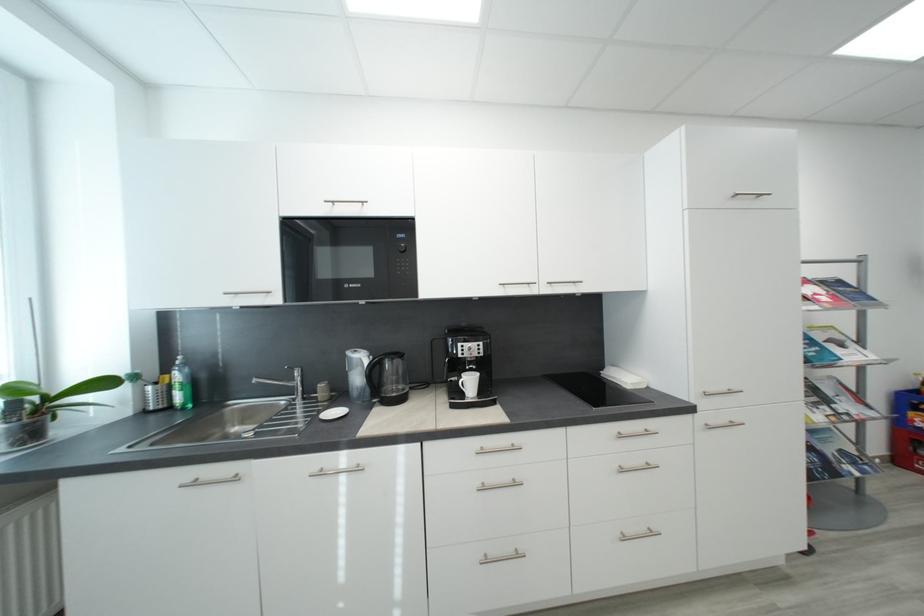
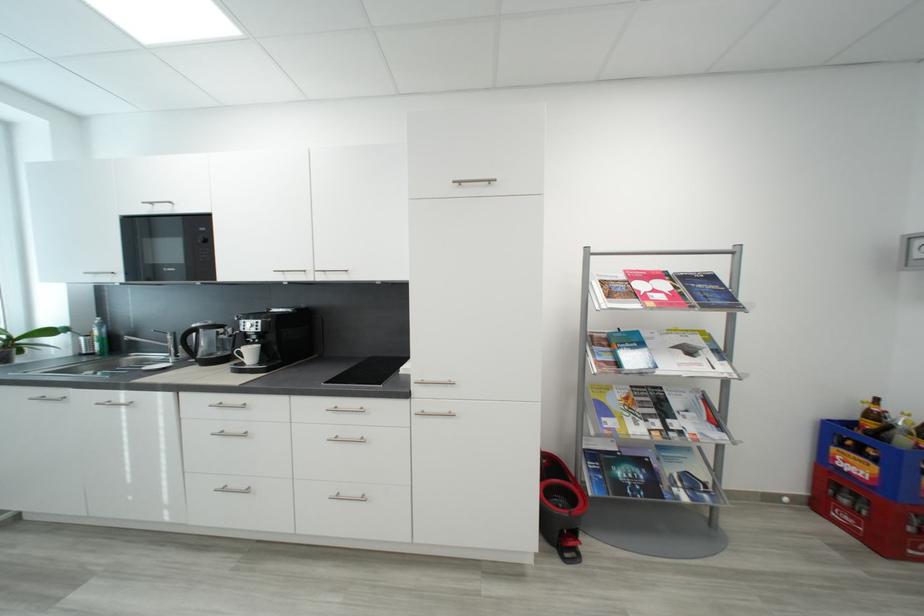
Locate, in the second image, the point that corresponds to (x=177, y=410) in the first image.

(100, 355)